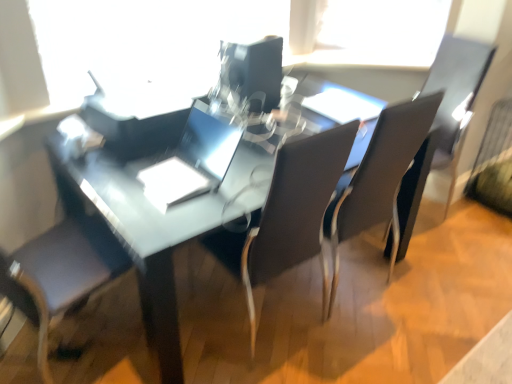
Locate an element on the screen. The image size is (512, 384). sleek silver laptop at center is located at coordinates (190, 160).

Describe the element at coordinates (139, 32) in the screenshot. The height and width of the screenshot is (384, 512). I see `transparent plastic window screen at upper center` at that location.

Describe the element at coordinates (161, 229) in the screenshot. I see `matte black table at center` at that location.

Describe the element at coordinates (254, 71) in the screenshot. I see `glossy plastic computer monitor at center` at that location.

Identify the location of matte black armchair at right. (444, 123).

Considering the relative positions of glossy plastic computer monitor at center and sleek silver laptop at center in the image provided, is glossy plastic computer monitor at center to the left or to the right of sleek silver laptop at center?

Clearly, glossy plastic computer monitor at center is on the right of sleek silver laptop at center in the image.

Can you tell me how much glossy plastic computer monitor at center and sleek silver laptop at center differ in facing direction?

101 degrees separate the facing orientations of glossy plastic computer monitor at center and sleek silver laptop at center.

Can you confirm if glossy plastic computer monitor at center is taller than sleek silver laptop at center?

Yes.

Is glossy plastic computer monitor at center completely or partially outside of sleek silver laptop at center?

That's correct, glossy plastic computer monitor at center is outside of sleek silver laptop at center.

From a real-world perspective, who is located higher, matte black chair at center, arranged as the 2th chair when viewed from the right, or matte black table at center?

matte black chair at center, arranged as the 2th chair when viewed from the right, from a real-world perspective.

Is matte black chair at center, arranged as the 2th chair when viewed from the right, not within matte black table at center?

That's incorrect, matte black chair at center, arranged as the 2th chair when viewed from the right, is not completely outside matte black table at center.

Find the location of a particular element. The image size is (512, 384). the 1st chair counting from the right side of the matte black table at center is located at coordinates (295, 212).

How many degrees apart are the facing directions of matte black chair at center, arranged as the 2th chair when viewed from the right, and matte black table at center?

There is a 180-degree angle between the facing directions of matte black chair at center, arranged as the 2th chair when viewed from the right, and matte black table at center.

Who is bigger, matte black table at center or matte black chair at center, which is the 1th chair from left to right?

matte black table at center.

Which is more to the left, matte black table at center or matte black chair at center, which is the 1th chair from left to right?

matte black table at center is more to the left.

From a real-world perspective, is matte black table at center on matte black chair at center, arranged as the 2th chair when viewed from the right?

Actually, matte black table at center is physically below matte black chair at center, arranged as the 2th chair when viewed from the right, in the real world.

Considering the relative sizes of matte black table at center and matte black chair at center, arranged as the 2th chair when viewed from the right, in the image provided, is matte black table at center taller than matte black chair at center, arranged as the 2th chair when viewed from the right,?

No, matte black table at center is not taller than matte black chair at center, arranged as the 2th chair when viewed from the right.

Is transparent plastic window screen at upper center thinner than glossy plastic computer monitor at center?

Indeed, transparent plastic window screen at upper center has a lesser width compared to glossy plastic computer monitor at center.

From the picture: Considering the relative sizes of transparent plastic window screen at upper center and glossy plastic computer monitor at center in the image provided, is transparent plastic window screen at upper center bigger than glossy plastic computer monitor at center?

Correct, transparent plastic window screen at upper center is larger in size than glossy plastic computer monitor at center.

From a real-world perspective, between transparent plastic window screen at upper center and glossy plastic computer monitor at center, who is vertically lower?

glossy plastic computer monitor at center, from a real-world perspective.

The width and height of the screenshot is (512, 384). Identify the location of laptop on the left side of glossy plastic computer monitor at center. (190, 160).

Is sleek silver laptop at center not near glossy plastic computer monitor at center?

No.

Is sleek silver laptop at center bigger or smaller than glossy plastic computer monitor at center?

In the image, sleek silver laptop at center appears to be smaller than glossy plastic computer monitor at center.

Is sleek silver laptop at center bigger than matte black chair at center, which is the 1th chair from left to right?

Actually, sleek silver laptop at center might be smaller than matte black chair at center, which is the 1th chair from left to right.

Is point (145, 163) more distant than point (317, 179)?

Yes, point (145, 163) is behind point (317, 179).

Considering the sizes of objects sleek silver laptop at center and matte black chair at center, which is the 1th chair from left to right, in the image provided, who is taller, sleek silver laptop at center or matte black chair at center, which is the 1th chair from left to right,?

With more height is matte black chair at center, which is the 1th chair from left to right.

Is sleek silver laptop at center oriented away from matte black chair at center, which is the 1th chair from left to right?

Yes, sleek silver laptop at center is positioned with its back facing matte black chair at center, which is the 1th chair from left to right.

Is transparent plastic window screen at upper center wider or thinner than matte black armchair at right?

Considering their sizes, transparent plastic window screen at upper center looks slimmer than matte black armchair at right.

How many degrees apart are the facing directions of transparent plastic window screen at upper center and matte black armchair at right?

96.6 degrees separate the facing orientations of transparent plastic window screen at upper center and matte black armchair at right.

From the picture: Does transparent plastic window screen at upper center touch matte black armchair at right?

transparent plastic window screen at upper center is not next to matte black armchair at right, and they're not touching.

From the image's perspective, who appears lower, transparent plastic window screen at upper center or matte black armchair at right?

matte black armchair at right appears lower in the image.

Image resolution: width=512 pixels, height=384 pixels. Identify the location of laptop that is below the glossy plastic computer monitor at center (from the image's perspective). (190, 160).

Locate an element on the screen. This screenshot has width=512, height=384. chair that is the 1st one when counting rightward from the matte black table at center is located at coordinates (295, 212).

From the image, which object appears to be farther from matte black chair at center, arranged as the 2th chair when viewed from the right, matte black armchair at right or matte black chair at center, the second chair when ordered from left to right?

matte black armchair at right.

Looking at the image, which one is located further to transparent plastic window screen at upper center, matte black armchair at right or matte black chair at center, acting as the 1th chair starting from the right?

matte black armchair at right.

Estimate the real-world distances between objects in this image. Which object is closer to transparent plastic window screen at upper center, matte black chair at center, acting as the 1th chair starting from the right, or glossy plastic computer monitor at center?

glossy plastic computer monitor at center.

Considering their positions, is glossy plastic computer monitor at center positioned closer to transparent plastic window screen at upper center than matte black chair at center, the second chair when ordered from left to right?

glossy plastic computer monitor at center is closer to transparent plastic window screen at upper center.

When comparing their distances from matte black armchair at right, does glossy plastic computer monitor at center or matte black chair at center, arranged as the 2th chair when viewed from the right, seem further?

matte black chair at center, arranged as the 2th chair when viewed from the right, lies further to matte black armchair at right than the other object.

Based on their spatial positions, is matte black table at center or glossy plastic computer monitor at center closer to sleek silver laptop at center?

Among the two, matte black table at center is located nearer to sleek silver laptop at center.

Looking at the image, which one is located further to glossy plastic computer monitor at center, matte black chair at center, the second chair when ordered from left to right, or matte black chair at center, arranged as the 2th chair when viewed from the right?

matte black chair at center, arranged as the 2th chair when viewed from the right, lies further to glossy plastic computer monitor at center than the other object.

Considering their positions, is matte black chair at center, acting as the 1th chair starting from the right, positioned closer to glossy plastic computer monitor at center than transparent plastic window screen at upper center?

transparent plastic window screen at upper center is positioned closer to the anchor glossy plastic computer monitor at center.

Find the location of `laptop between transparent plastic window screen at upper center and matte black table at center in the vertical direction`. laptop between transparent plastic window screen at upper center and matte black table at center in the vertical direction is located at coordinates (190, 160).

Identify the location of chair situated between matte black table at center and matte black chair at center, acting as the 1th chair starting from the right, from left to right. pyautogui.click(x=295, y=212).

This screenshot has height=384, width=512. Find the location of `laptop between matte black table at center and glossy plastic computer monitor at center in the front-back direction`. laptop between matte black table at center and glossy plastic computer monitor at center in the front-back direction is located at coordinates (190, 160).

Locate an element on the screen. table located between sleek silver laptop at center and matte black armchair at right in the left-right direction is located at coordinates (161, 229).